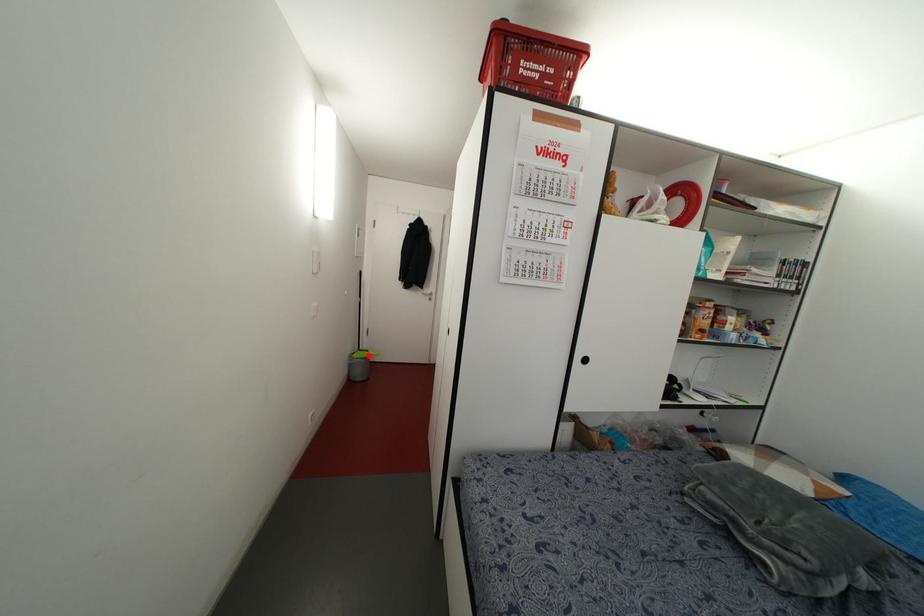
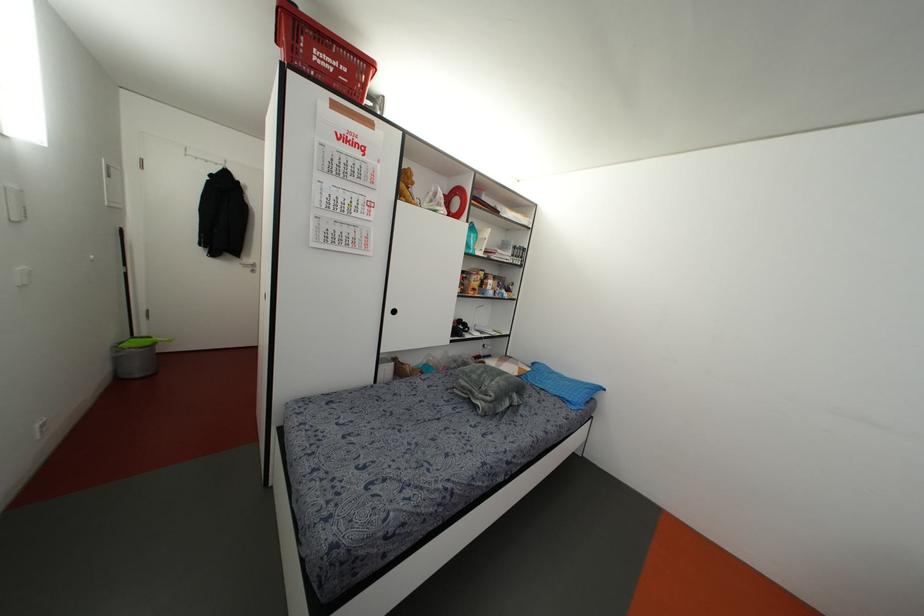
Where in the second image is the point corresponding to the highlighted location from the first image?

(153, 342)